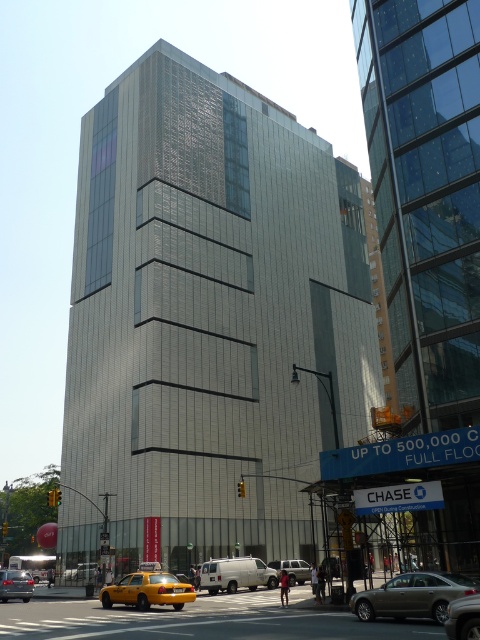
Question: Among these objects, which one is nearest to the camera?

Choices:
 (A) white matte van at center
 (B) yellow matte taxi at lower left

Answer: (B)

Question: Does yellow matte taxi at lower left have a lesser width compared to silver metallic suv at center?

Choices:
 (A) no
 (B) yes

Answer: (A)

Question: Estimate the real-world distances between objects in this image. Which object is closer to the white matte van at center?

Choices:
 (A) gold metallic sedan at lower right
 (B) yellow matte taxi at lower left
 (C) metallic silver car at lower left
 (D) metallic silver sedan at lower right

Answer: (B)

Question: Among these objects, which one is farthest from the camera?

Choices:
 (A) yellow matte taxi at lower left
 (B) silver metallic suv at center

Answer: (B)

Question: Can you confirm if white matte van at center is positioned to the left of silver metallic suv at center?

Choices:
 (A) no
 (B) yes

Answer: (B)

Question: Does gold metallic sedan at lower right have a smaller size compared to metallic silver sedan at lower right?

Choices:
 (A) yes
 (B) no

Answer: (A)